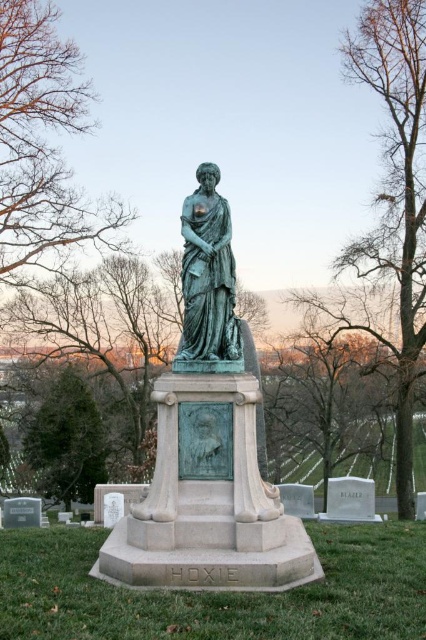
You are standing in the cemetery and want to take a photo of the green patina statue at center. If your camera has a maximum focus range of 7 meters, will you be able to capture the statue clearly?

The green patina statue at center is 7.27 meters from viewer. Since the distance is beyond the camera maximum focus range of 7 meters, the statue will be out of focus and unclear.

You are standing at the point closest to the statue base. There are two points marked in the image, point 1 at coordinates (25,202) and point 2 at coordinates (189,260). Which point is closer to you?

Point 2 at coordinates (189,260) is closer to you because it is in front of point 1 at coordinates (25,202).

You are standing in front of the green bronze statue at lower left and want to see the brown leafless branches at upper left. Which direction should you move to get a better view of the branches?

You should move to the right of the green bronze statue at lower left to get a better view of the brown leafless branches at upper left because the branches are further away from the viewer compared to the statue.